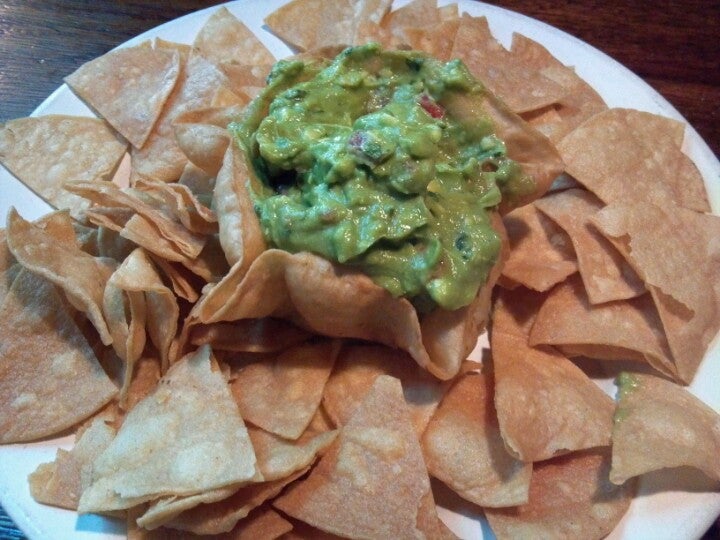
Image resolution: width=720 pixels, height=540 pixels. In order to click on table on the top left in this screenshot , I will do `click(55, 8)`.